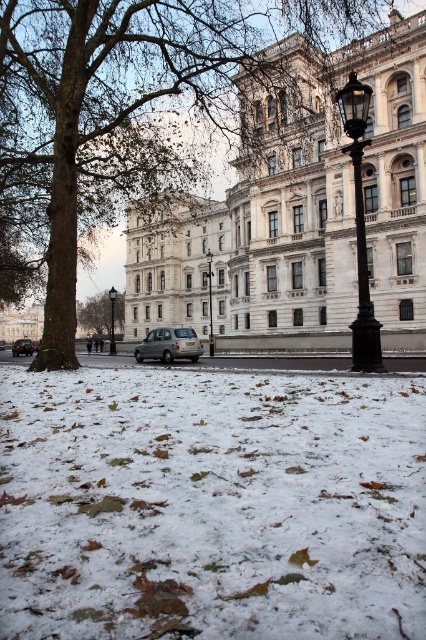
Question: Among these objects, which one is farthest from the camera?

Choices:
 (A) white stone building at upper center
 (B) polished brass lamp post at center-right
 (C) green leafy tree at center-left
 (D) silver metallic car at lower left

Answer: (C)

Question: Does white stone building at upper center have a lesser width compared to polished brass lamp post at center-right?

Choices:
 (A) no
 (B) yes

Answer: (A)

Question: Does white stone building at upper center have a greater width compared to black polished lamp post at center?

Choices:
 (A) yes
 (B) no

Answer: (A)

Question: Can you confirm if silver metallic van at center is smaller than silver metallic car at lower left?

Choices:
 (A) yes
 (B) no

Answer: (B)

Question: Which object is closer to the camera taking this photo?

Choices:
 (A) white stone building at upper center
 (B) silver metallic van at center
 (C) polished brass lamp post at center-right
 (D) green leafy tree at center-left

Answer: (C)

Question: Which object is closer to the camera taking this photo?

Choices:
 (A) white powdery snow at lower center
 (B) polished brass lamp post at center-right
 (C) silver metallic car at lower left
 (D) black metal lamp post at center

Answer: (A)